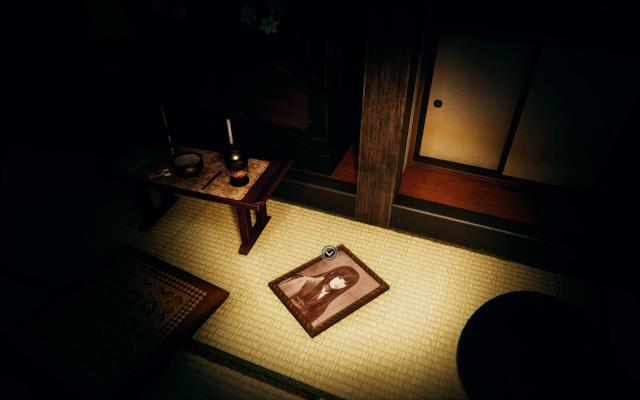
Image resolution: width=640 pixels, height=400 pixels. Find the location of `portrait`. portrait is located at coordinates (348, 287).